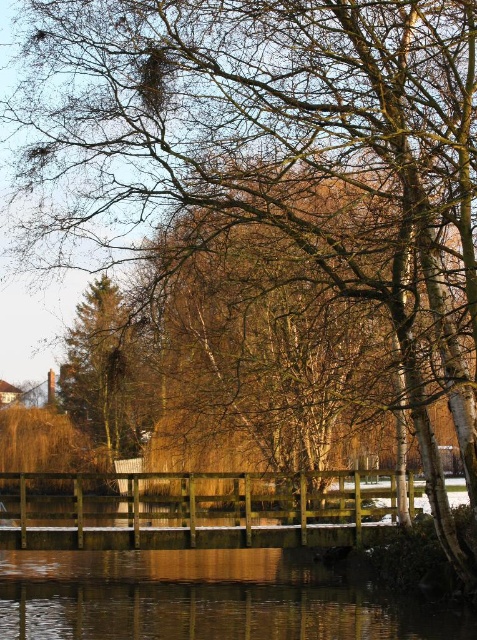
Does transparent water at lower center appear under green matte tree at left?

Indeed, transparent water at lower center is positioned under green matte tree at left.

Can you confirm if transparent water at lower center is positioned to the right of green matte tree at left?

Indeed, transparent water at lower center is positioned on the right side of green matte tree at left.

The height and width of the screenshot is (640, 477). Find the location of `transparent water at lower center`. transparent water at lower center is located at coordinates (207, 598).